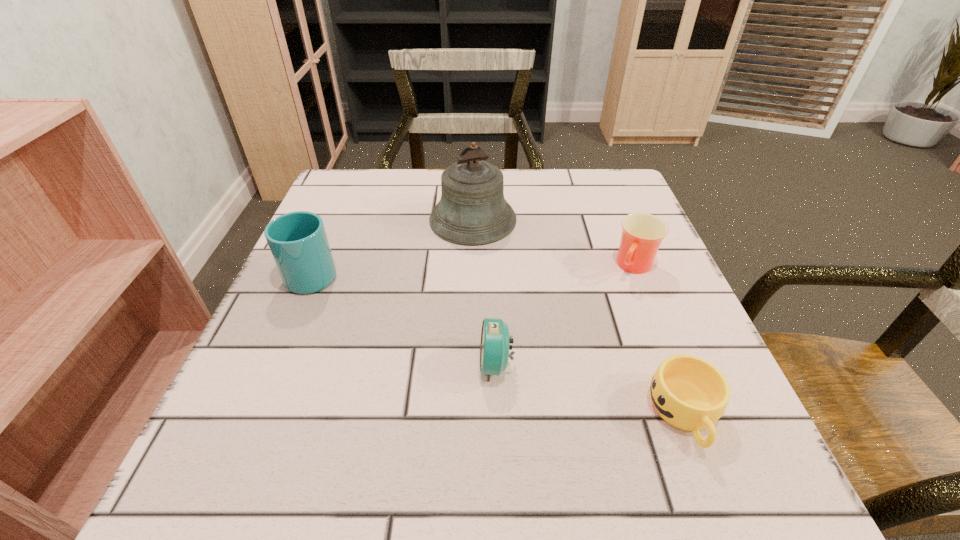
At what (x,y) coordinates should I click in order to perform the action: click on free space located 0.120m on the handle side of the tallest cup. Please return your answer as a coordinate pair (x, y). Image resolution: width=960 pixels, height=540 pixels. Looking at the image, I should click on (336, 219).

This screenshot has width=960, height=540. I want to click on free location located 0.310m on the handle side of the tallest cup, so click(x=354, y=177).

In order to click on free point located 0.130m on the back of the second shortest cup in this screenshot , I will do `click(614, 215)`.

Where is `vacant area located on the front-facing side of the alarm clock`? The image size is (960, 540). vacant area located on the front-facing side of the alarm clock is located at coordinates (247, 364).

You are a GUI agent. You are given a task and a screenshot of the screen. Output one action in this format:
    pyautogui.click(x=<x>, y=<y>)
    Task: Click on the vacant region located on the front-facing side of the alarm clock
    
    Given the screenshot: What is the action you would take?
    pyautogui.click(x=417, y=364)

The height and width of the screenshot is (540, 960). I want to click on free space located on the front-facing side of the alarm clock, so click(x=392, y=364).

Locate an element on the screen. The width and height of the screenshot is (960, 540). vacant point located 0.050m on the front of the shortest cup is located at coordinates (716, 497).

You are a GUI agent. You are given a task and a screenshot of the screen. Output one action in this format:
    pyautogui.click(x=<x>, y=<y>)
    Task: Click on the object that is at the far edge
    The width and height of the screenshot is (960, 540).
    Given the screenshot: What is the action you would take?
    pyautogui.click(x=472, y=210)

I want to click on object present at the near edge, so click(x=688, y=392).

You are a GUI agent. You are given a task and a screenshot of the screen. Output one action in this format:
    pyautogui.click(x=<x>, y=<y>)
    Task: Click on the object that is at the left edge
    The image size is (960, 540).
    Given the screenshot: What is the action you would take?
    pyautogui.click(x=298, y=242)